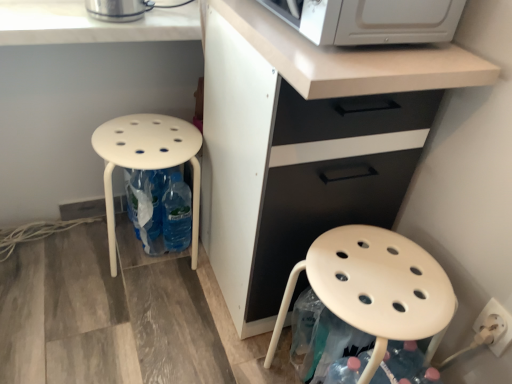
Question: Is white matte cabinet at center taller or shorter than matte white stool at lower left, marked as the 1th stool in a right-to-left arrangement?

Choices:
 (A) short
 (B) tall

Answer: (B)

Question: Is point coord(301,195) positioned closer to the camera than point coord(350,276)?

Choices:
 (A) farther
 (B) closer

Answer: (A)

Question: Which of these objects is positioned closest to the matte white stool at lower left, marked as the 1th stool in a right-to-left arrangement?

Choices:
 (A) white plastic stool at lower left, the first stool viewed from the left
 (B) white matte cabinet at center
 (C) white plastic electric outlet at lower right
 (D) white marble countertop at upper left

Answer: (B)

Question: Which object is the farthest from the white matte cabinet at center?

Choices:
 (A) white plastic electric outlet at lower right
 (B) matte white stool at lower left, marked as the 1th stool in a right-to-left arrangement
 (C) white marble countertop at upper left
 (D) white plastic stool at lower left, the first stool viewed from the left

Answer: (A)